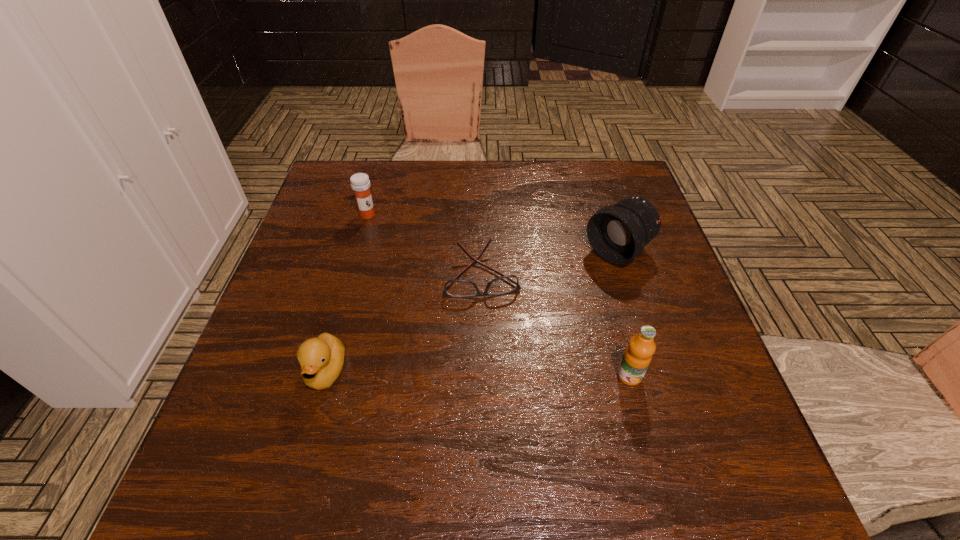
This screenshot has height=540, width=960. I want to click on duckling, so click(x=321, y=359).

Locate an element on the screen. This screenshot has width=960, height=540. orange juice is located at coordinates (637, 356).

Find the location of `medicine`. medicine is located at coordinates tap(360, 183).

Find the location of a particular element. The height and width of the screenshot is (540, 960). the third object from right to left is located at coordinates 457,288.

Where is `spectacles`? spectacles is located at coordinates (457, 288).

At what (x,y) coordinates should I click in order to perform the action: click on telephoto lens. Please return your answer as a coordinate pair (x, y). Looking at the image, I should click on (618, 234).

The width and height of the screenshot is (960, 540). I want to click on vacant region located 0.100m on the label of the orange juice, so click(x=646, y=438).

Where is `vacant space located on the label side of the medicine`? The image size is (960, 540). vacant space located on the label side of the medicine is located at coordinates (416, 272).

I want to click on free space located on the label side of the medicine, so click(x=396, y=248).

The width and height of the screenshot is (960, 540). I want to click on free space located on the label side of the medicine, so click(420, 276).